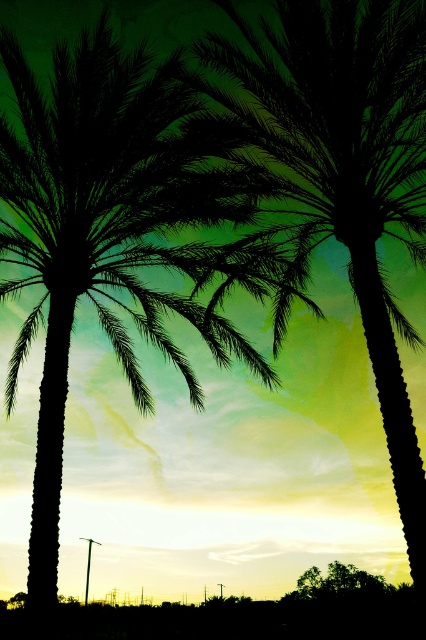
Who is lower down, black silhouette palm tree at center or silhouette palm tree at center?

black silhouette palm tree at center is lower down.

Can you confirm if black silhouette palm tree at center is positioned to the right of silhouette palm tree at center?

In fact, black silhouette palm tree at center is to the left of silhouette palm tree at center.

Which is in front, point (127, 256) or point (276, 145)?

Point (276, 145)

The image size is (426, 640). In order to click on black silhouette palm tree at center in this screenshot , I will do `click(104, 230)`.

Based on the photo, which is below, silhouette palm tree at center or silhouette leafy tree at lower center?

silhouette leafy tree at lower center is below.

Which is above, silhouette palm tree at center or silhouette leafy tree at lower center?

Positioned higher is silhouette palm tree at center.

What do you see at coordinates (339, 170) in the screenshot? I see `silhouette palm tree at center` at bounding box center [339, 170].

You are a GUI agent. You are given a task and a screenshot of the screen. Output one action in this format:
    pyautogui.click(x=<x>, y=<y>)
    Task: Click on the silhouette palm tree at center
    Image resolution: width=426 pixels, height=640 pixels.
    Given the screenshot: What is the action you would take?
    pyautogui.click(x=339, y=170)

Is point (147, 80) positioned after point (301, 580)?

No, it is not.

Does point (149, 84) lie in front of point (319, 593)?

That is True.

Locate an element on the screen. The width and height of the screenshot is (426, 640). black silhouette palm tree at center is located at coordinates (104, 230).